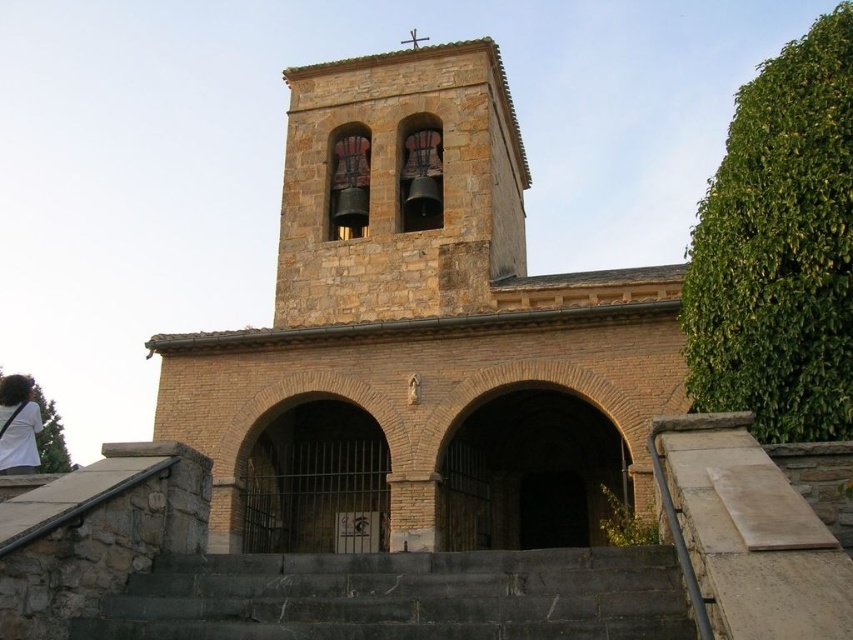
Who is more distant from viewer, (254, 348) or (206, 595)?

The point (254, 348) is more distant.

Does brown stone chapel at center appear over dark gray stone stairs at center?

Yes.

This screenshot has width=853, height=640. What are the coordinates of `brown stone chapel at center` in the screenshot? It's located at (421, 337).

I want to click on brown stone chapel at center, so click(421, 337).

Who is taller, dark gray stone stairs at center or white cotton shirt at lower left?

white cotton shirt at lower left is taller.

I want to click on dark gray stone stairs at center, so click(401, 596).

What do you see at coordinates (401, 596) in the screenshot? Image resolution: width=853 pixels, height=640 pixels. I see `dark gray stone stairs at center` at bounding box center [401, 596].

At what (x,y) coordinates should I click in order to perform the action: click on dark gray stone stairs at center. Please return your answer as a coordinate pair (x, y). The width and height of the screenshot is (853, 640). Looking at the image, I should click on (401, 596).

Who is positioned more to the right, brown stone chapel at center or white cotton shirt at lower left?

brown stone chapel at center

Between point (383, 376) and point (26, 385), which one is positioned behind?

The point (383, 376) is behind.

Does point (376, 481) come behind point (27, 420)?

Yes.

The height and width of the screenshot is (640, 853). Find the location of `brown stone chapel at center`. brown stone chapel at center is located at coordinates (421, 337).